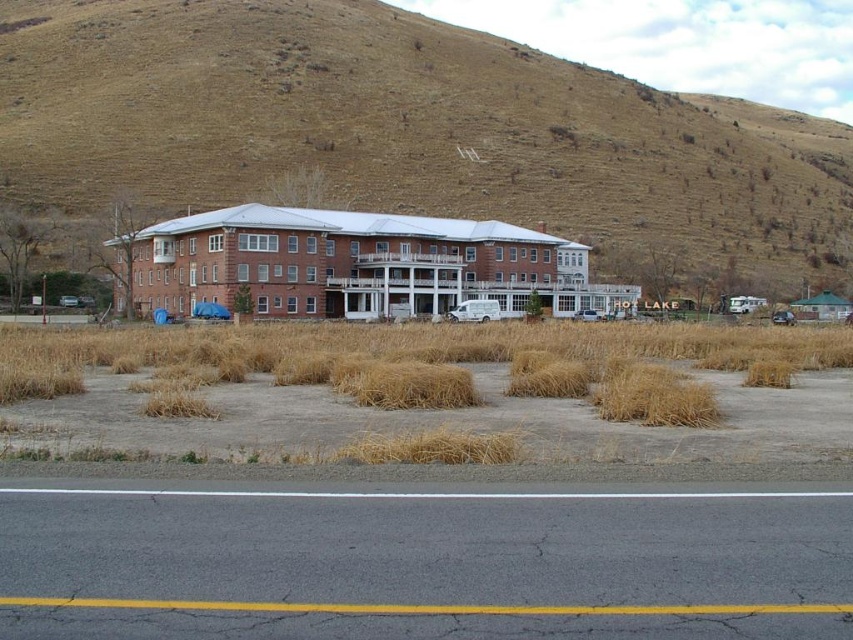
Looking at this image, between brown grassy hillside at upper center and dry straw at lower center, which one appears on the right side from the viewer's perspective?

brown grassy hillside at upper center is more to the right.

Between point (431, 204) and point (451, 349), which one is positioned behind?

The point (431, 204) is more distant.

Is point (439, 150) positioned after point (235, 339)?

Yes.

At what (x,y) coordinates should I click in order to perform the action: click on brown grassy hillside at upper center. Please return your answer as a coordinate pair (x, y). This screenshot has height=640, width=853. Looking at the image, I should click on (405, 131).